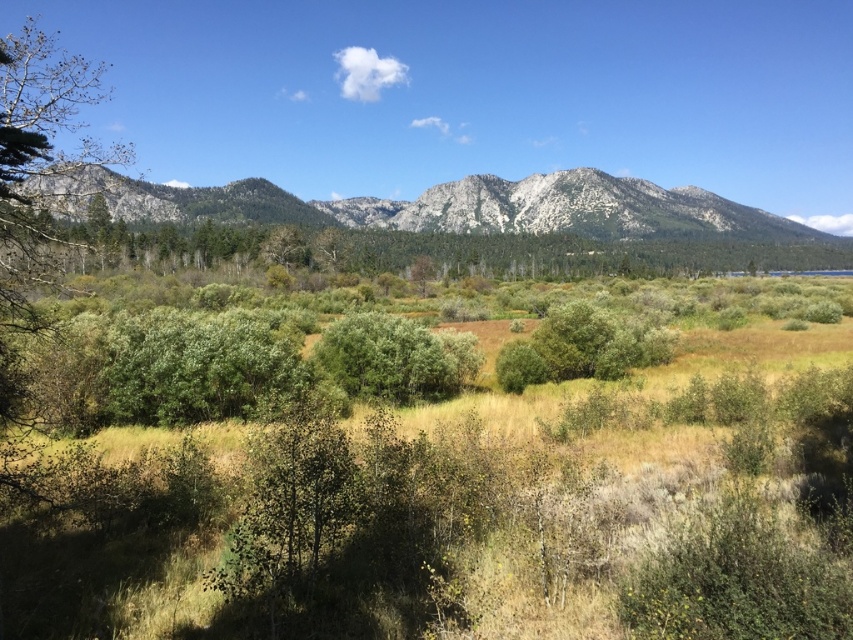
Question: Which point is farther from the camera taking this photo?

Choices:
 (A) (384, 317)
 (B) (252, 246)

Answer: (B)

Question: Can you confirm if gray rocky mountain range at center is thinner than green leafy bush at center?

Choices:
 (A) no
 (B) yes

Answer: (A)

Question: Estimate the real-world distances between objects in this image. Which object is closer to the green leafy bush at center?

Choices:
 (A) gray rocky mountain range at center
 (B) green leafy trees at center

Answer: (B)

Question: Is gray rocky mountain range at center positioned before green leafy bush at center?

Choices:
 (A) no
 (B) yes

Answer: (B)

Question: Among these points, which one is farthest from the camera?

Choices:
 (A) (119, 250)
 (B) (451, 346)

Answer: (A)

Question: From the image, what is the correct spatial relationship of gray rocky mountain range at center in relation to green leafy trees at center?

Choices:
 (A) left
 (B) right

Answer: (A)